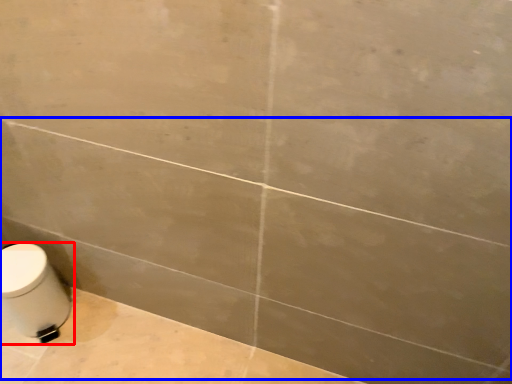
Question: Which of the following is the farthest to the observer, toilet (highlighted by a red box) or bath (highlighted by a blue box)?

Choices:
 (A) toilet
 (B) bath

Answer: (A)